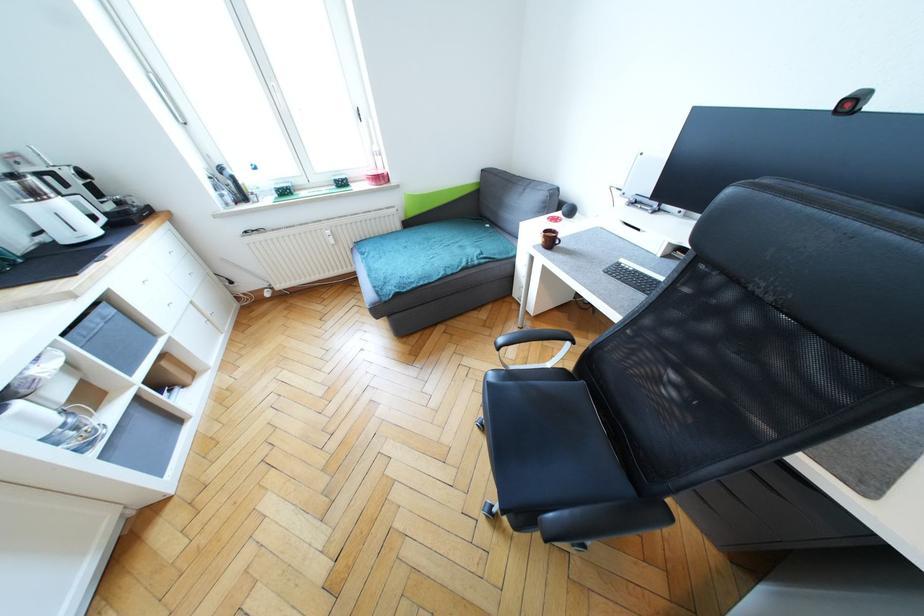
Locate an element on the screen. window handle is located at coordinates (359, 114).